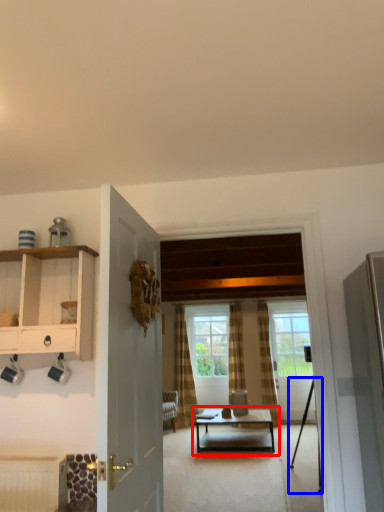
Question: Which object is closer to the camera taking this photo, coffee table (highlighted by a red box) or tripod (highlighted by a blue box)?

Choices:
 (A) coffee table
 (B) tripod

Answer: (B)